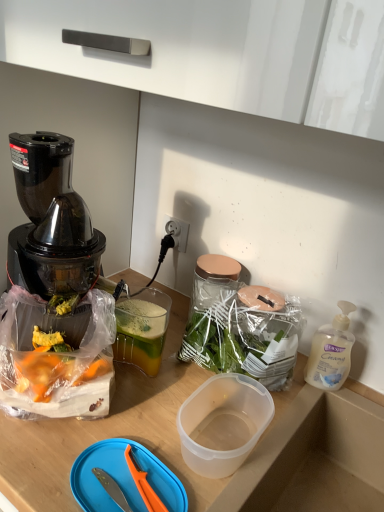
In order to face blue plastic cutting board at lower center, should I rotate leftwards or rightwards?

Rotate left and turn 8.584 degrees.

Describe the element at coordinates (123, 477) in the screenshot. I see `blue plastic cutting board at lower center` at that location.

This screenshot has width=384, height=512. I want to click on blue plastic cutting board at lower center, so click(123, 477).

This screenshot has width=384, height=512. Identify the location of translucent plastic soap dispenser at right. (331, 352).

What do you see at coordinates (331, 352) in the screenshot?
I see `translucent plastic soap dispenser at right` at bounding box center [331, 352].

What are the coordinates of `blue plastic cutting board at lower center` in the screenshot? It's located at [123, 477].

Considering the positions of objects translucent plastic soap dispenser at right and blue plastic cutting board at lower center in the image provided, who is more to the right, translucent plastic soap dispenser at right or blue plastic cutting board at lower center?

translucent plastic soap dispenser at right is more to the right.

Is translucent plastic soap dispenser at right closer to the viewer compared to blue plastic cutting board at lower center?

That is False.

Between point (319, 364) and point (74, 477), which one is positioned in front?

The point (74, 477) is more forward.

From the image's perspective, which one is positioned lower, translucent plastic soap dispenser at right or blue plastic cutting board at lower center?

blue plastic cutting board at lower center.

From a real-world perspective, is translucent plastic soap dispenser at right beneath blue plastic cutting board at lower center?

No, from a real-world perspective, translucent plastic soap dispenser at right is not below blue plastic cutting board at lower center.

Can you confirm if translucent plastic soap dispenser at right is thinner than blue plastic cutting board at lower center?

Indeed, translucent plastic soap dispenser at right has a lesser width compared to blue plastic cutting board at lower center.

Based on the photo, does translucent plastic soap dispenser at right have a greater height compared to blue plastic cutting board at lower center?

Yes, translucent plastic soap dispenser at right is taller than blue plastic cutting board at lower center.

Looking at this image, considering the sizes of objects translucent plastic soap dispenser at right and blue plastic cutting board at lower center in the image provided, who is smaller, translucent plastic soap dispenser at right or blue plastic cutting board at lower center?

blue plastic cutting board at lower center is smaller.

Would you say translucent plastic soap dispenser at right is outside blue plastic cutting board at lower center?

Yes, translucent plastic soap dispenser at right is located beyond the bounds of blue plastic cutting board at lower center.

Is translucent plastic soap dispenser at right not close to blue plastic cutting board at lower center?

Actually, translucent plastic soap dispenser at right and blue plastic cutting board at lower center are a little close together.

Is translucent plastic soap dispenser at right looking in the opposite direction of blue plastic cutting board at lower center?

translucent plastic soap dispenser at right is not turned away from blue plastic cutting board at lower center.

How different are the orientations of translucent plastic soap dispenser at right and blue plastic cutting board at lower center in degrees?

The facing directions of translucent plastic soap dispenser at right and blue plastic cutting board at lower center are 2.04 degrees apart.

How far apart are translucent plastic soap dispenser at right and blue plastic cutting board at lower center?

A distance of 16.95 inches exists between translucent plastic soap dispenser at right and blue plastic cutting board at lower center.

Locate an element on the screen. The width and height of the screenshot is (384, 512). cutting board located below the translucent plastic soap dispenser at right (from the image's perspective) is located at coordinates (123, 477).

In the image, is blue plastic cutting board at lower center on the left side or the right side of translucent plastic soap dispenser at right?

blue plastic cutting board at lower center is positioned on translucent plastic soap dispenser at right's left side.

Considering the relative positions of blue plastic cutting board at lower center and translucent plastic soap dispenser at right in the image provided, is blue plastic cutting board at lower center behind translucent plastic soap dispenser at right?

No, blue plastic cutting board at lower center is closer to the camera.

Considering the points (113, 468) and (316, 332), which point is in front, point (113, 468) or point (316, 332)?

Point (113, 468)

From the image's perspective, relative to translucent plastic soap dispenser at right, is blue plastic cutting board at lower center above or below?

Clearly, from the image's perspective, blue plastic cutting board at lower center is below translucent plastic soap dispenser at right.

From a real-world perspective, is blue plastic cutting board at lower center beneath translucent plastic soap dispenser at right?

Correct, in the physical world, blue plastic cutting board at lower center is lower than translucent plastic soap dispenser at right.

Considering the relative sizes of blue plastic cutting board at lower center and translucent plastic soap dispenser at right in the image provided, is blue plastic cutting board at lower center thinner than translucent plastic soap dispenser at right?

In fact, blue plastic cutting board at lower center might be wider than translucent plastic soap dispenser at right.

Is blue plastic cutting board at lower center taller than translucent plastic soap dispenser at right?

No.

Based on their sizes in the image, would you say blue plastic cutting board at lower center is bigger or smaller than translucent plastic soap dispenser at right?

Clearly, blue plastic cutting board at lower center is smaller in size than translucent plastic soap dispenser at right.

Is blue plastic cutting board at lower center positioned beyond the bounds of translucent plastic soap dispenser at right?

Yes, blue plastic cutting board at lower center is located beyond the bounds of translucent plastic soap dispenser at right.

In the scene shown: Is blue plastic cutting board at lower center beside translucent plastic soap dispenser at right?

No, blue plastic cutting board at lower center is not with translucent plastic soap dispenser at right.

Is blue plastic cutting board at lower center positioned with its back to translucent plastic soap dispenser at right?

No, blue plastic cutting board at lower center's orientation is not away from translucent plastic soap dispenser at right.

Can you tell me how much blue plastic cutting board at lower center and translucent plastic soap dispenser at right differ in facing direction?

2.04 degrees.

Could you measure the distance between blue plastic cutting board at lower center and translucent plastic soap dispenser at right?

The distance of blue plastic cutting board at lower center from translucent plastic soap dispenser at right is 16.95 inches.

Locate an element on the screen. bottle on the right of the blue plastic cutting board at lower center is located at coordinates (331, 352).

I want to click on cutting board that appears on the left of translucent plastic soap dispenser at right, so pyautogui.click(x=123, y=477).

Where is `cutting board below the translucent plastic soap dispenser at right (from the image's perspective)`? cutting board below the translucent plastic soap dispenser at right (from the image's perspective) is located at coordinates (123, 477).